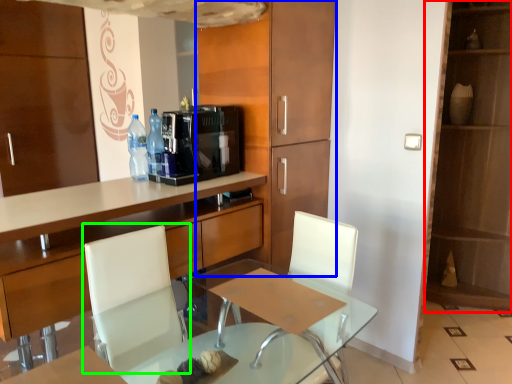
Question: Estimate the real-world distances between objects in this image. Which object is closer to dresser (highlighted by a red box), cabinetry (highlighted by a blue box) or armchair (highlighted by a green box)?

Choices:
 (A) cabinetry
 (B) armchair

Answer: (A)